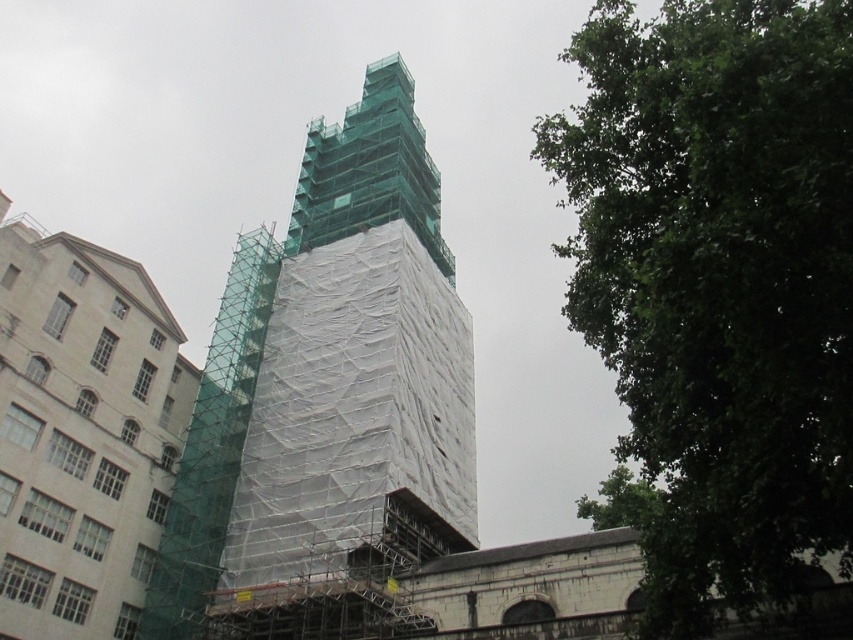
You are standing at the base of the construction site and want to take a photo of the green leafy tree at upper right. Given that the camera you are using has a maximum zoom range of 80 feet, will you be able to capture the entire tree in the photo without moving closer?

The green leafy tree at upper right is 82.57 feet away from the viewer. Since the camera can only zoom up to 80 feet, you will not be able to capture the entire tree without moving closer.

You are standing at the base of the tall building under construction. You want to plant a new tree in the area. The construction site has a rule that no trees can be planted within 0.5 units of the building. Is the point at coordinates point (717, 285) safe to plant a tree?

The point at coordinates point (717, 285) is where the green leafy tree at upper right is located. Since the existing tree is already there, planting another tree at that point would violate the construction site rule. Please choose a different location.